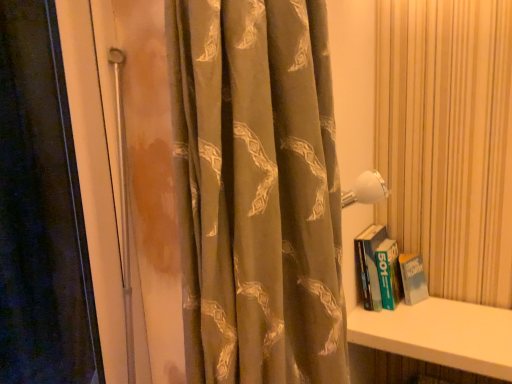
Question: Is white smooth shelf at lower right not near green matte book at right?

Choices:
 (A) yes
 (B) no

Answer: (B)

Question: Does white smooth shelf at lower right have a greater height compared to green matte book at right?

Choices:
 (A) yes
 (B) no

Answer: (A)

Question: Can you confirm if white smooth shelf at lower right is positioned to the right of green matte book at right?

Choices:
 (A) yes
 (B) no

Answer: (A)

Question: Does white smooth shelf at lower right turn towards green matte book at right?

Choices:
 (A) no
 (B) yes

Answer: (A)

Question: Is white smooth shelf at lower right completely or partially outside of green matte book at right?

Choices:
 (A) yes
 (B) no

Answer: (A)

Question: Considering the positions of point (348, 339) and point (407, 254), is point (348, 339) closer or farther from the camera than point (407, 254)?

Choices:
 (A) closer
 (B) farther

Answer: (A)

Question: In the image, is white smooth shelf at lower right on the left side or the right side of green matte book at right?

Choices:
 (A) right
 (B) left

Answer: (A)

Question: Relative to green matte book at right, is white smooth shelf at lower right in front or behind?

Choices:
 (A) behind
 (B) front

Answer: (B)

Question: Considering the positions of white smooth shelf at lower right and green matte book at right in the image, is white smooth shelf at lower right taller or shorter than green matte book at right?

Choices:
 (A) short
 (B) tall

Answer: (B)

Question: Is silky brown curtain at center taller or shorter than green matte book at right?

Choices:
 (A) tall
 (B) short

Answer: (A)

Question: Considering the positions of silky brown curtain at center and green matte book at right in the image, is silky brown curtain at center wider or thinner than green matte book at right?

Choices:
 (A) wide
 (B) thin

Answer: (A)

Question: Is point (201, 19) closer or farther from the camera than point (401, 271)?

Choices:
 (A) farther
 (B) closer

Answer: (B)

Question: In the image, is silky brown curtain at center positioned in front of or behind green matte book at right?

Choices:
 (A) front
 (B) behind

Answer: (A)

Question: From a real-world perspective, relative to silky brown curtain at center, is green matte book at right vertically above or below?

Choices:
 (A) below
 (B) above

Answer: (A)

Question: Is green matte book at right to the left or to the right of silky brown curtain at center in the image?

Choices:
 (A) left
 (B) right

Answer: (B)